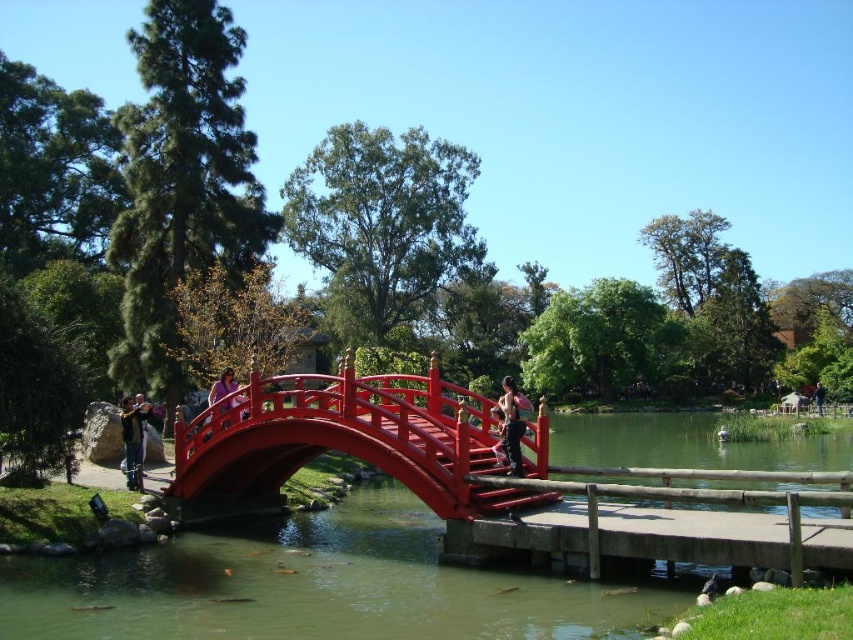
Question: Is wooden dock at center positioned in front of blue fabric jacket at center?

Choices:
 (A) no
 (B) yes

Answer: (B)

Question: Which of the following is the closest to the observer?

Choices:
 (A) glossy wood bridge at center
 (B) matte pink tank top at center
 (C) blue fabric jacket at center
 (D) purple fabric at center

Answer: (A)

Question: Is wooden dock at center positioned before blue fabric jacket at center?

Choices:
 (A) no
 (B) yes

Answer: (B)

Question: Which point appears closest to the camera in this image?

Choices:
 (A) (137, 410)
 (B) (459, 444)

Answer: (B)

Question: Is glossy wood bridge at center above wooden dock at center?

Choices:
 (A) no
 (B) yes

Answer: (A)

Question: Which point is farther to the camera?

Choices:
 (A) (496, 488)
 (B) (509, 426)
 (C) (126, 461)
 (D) (228, 374)

Answer: (D)